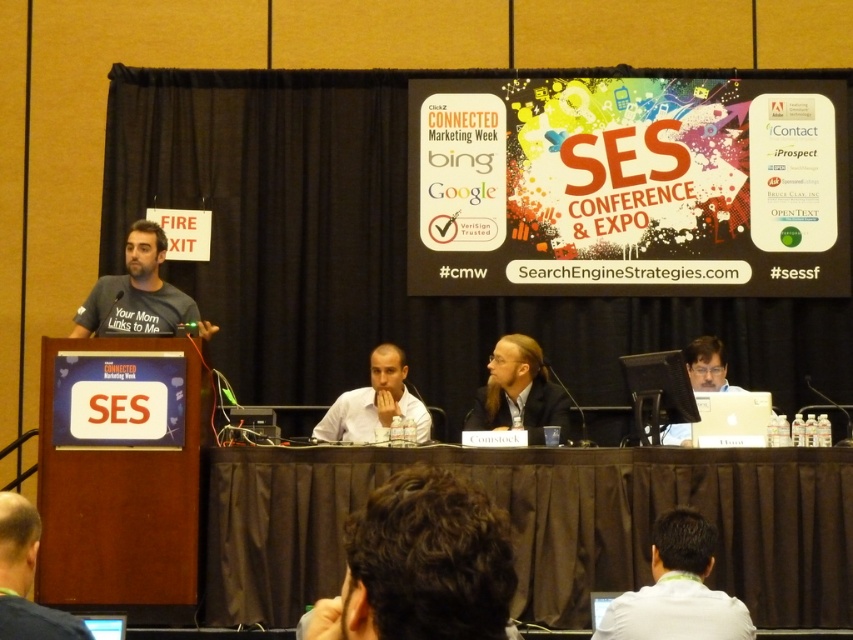
Looking at this image, you are an attendee at the SES Conference. You see the brown fabric table at lower center and the white shirt at lower right. Which object is positioned lower in the image?

The brown fabric table at lower center is located below the white shirt at lower right, so the brown fabric table at lower center is positioned lower in the image.

Based on the scene description, can you determine the spatial relationship between the white shirt at lower right and the light brown wood table at center?

The white shirt at lower right is located below the light brown wood table at center according to the description.

You are a photographer positioned at the back of the room. You need to take a photo of the light brown wood table at center and the dark blue shirt at lower left. How far apart are these two objects in the image?

The light brown wood table at center is 6.77 meters from the dark blue shirt at lower left.